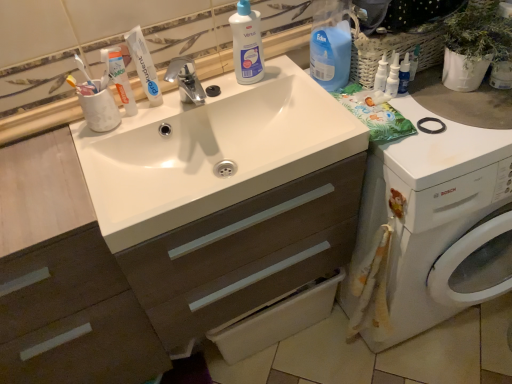
This screenshot has width=512, height=384. I want to click on free space in front of white glossy spray bottle at upper right, placed as the 1th cleaning product when sorted from right to left, so click(x=434, y=136).